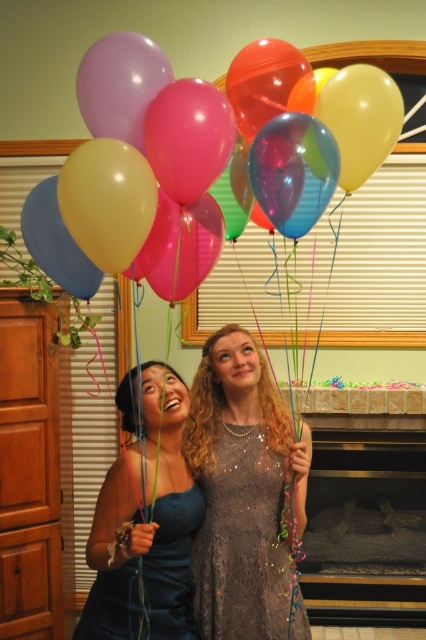
You are planning to take a photo of the two people in the scene. The translucent glossy balloons at upper center and the dark blue satin dress at lower left are both important elements. Since the balloons are higher up, will you need to adjust your camera angle to ensure both are in focus?

The translucent glossy balloons at upper center has a greater height compared to the dark blue satin dress at lower left, so you will need to adjust your camera angle upwards to ensure both elements are in focus.

You are planning to take a photo of the translucent glossy balloons at upper center and the sequined fabric dress at center. Based on their sizes, which object would appear bigger in the photo?

The translucent glossy balloons at upper center would appear bigger in the photo because their width is larger than the sequined fabric dress at center.